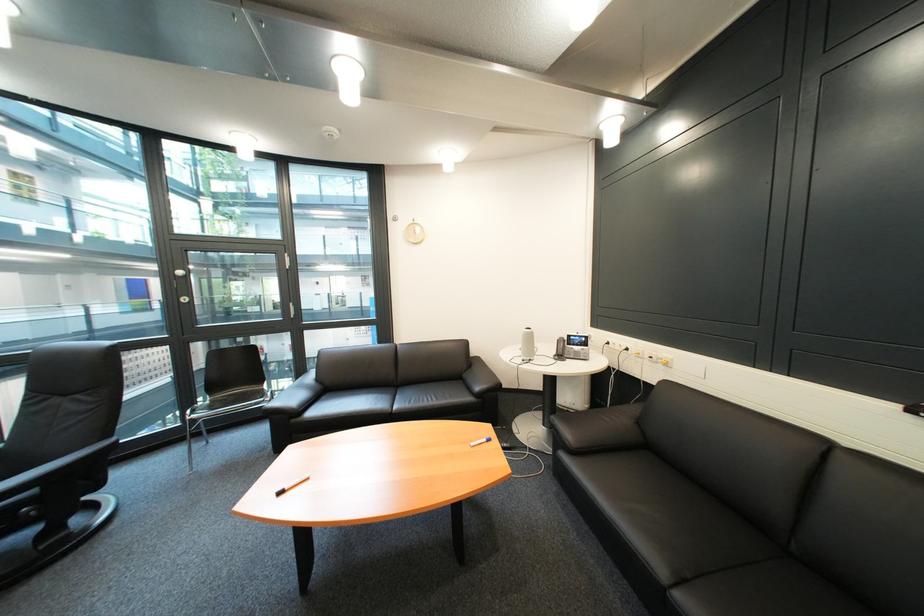
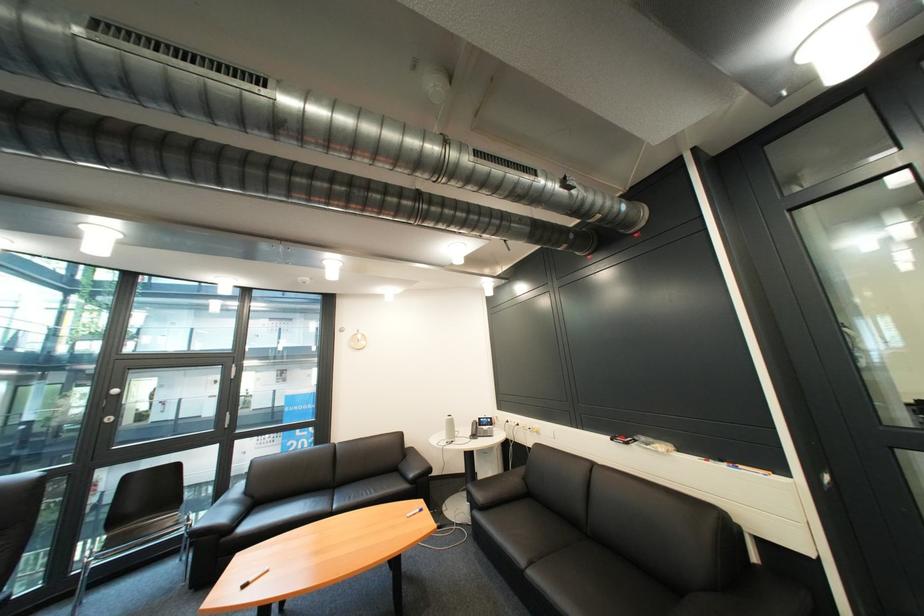
Find the pixel in the second image that matches (x=479, y=377) in the first image.

(414, 468)